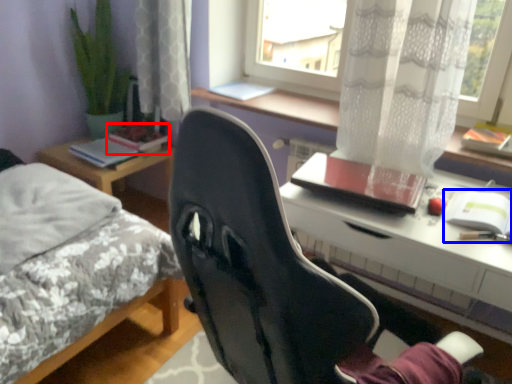
Question: Which object is closer to the camera taking this photo, book (highlighted by a red box) or notebook (highlighted by a blue box)?

Choices:
 (A) book
 (B) notebook

Answer: (B)